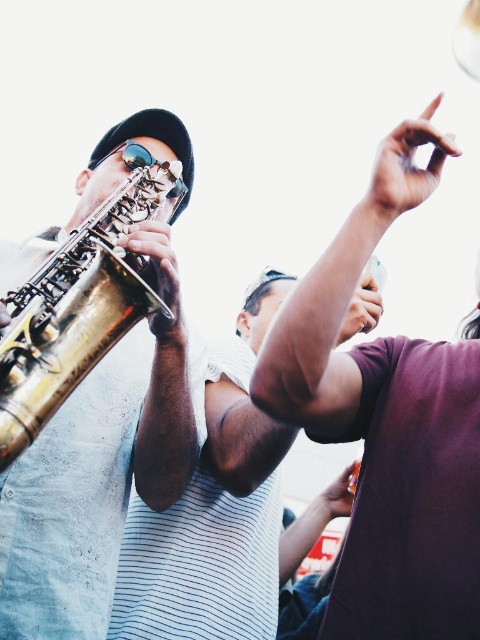
You are a photographer taking a picture of the scene. You notice the dark purple shirt at upper right and the gold polished trumpet at left. Which object should you focus on if you want to capture the larger one in your shot?

The dark purple shirt at upper right is bigger than the gold polished trumpet at left, so you should focus on the dark purple shirt at upper right to capture the larger one.

You are a photographer standing in the crowd and want to take a photo that includes both the dark purple shirt at upper right and the gold polished trumpet at left. Which object should you focus on first to ensure both are in the frame?

The dark purple shirt at upper right is much taller than the gold polished trumpet at left, so you should focus on the dark purple shirt at upper right first to ensure both are in the frame.

You are standing in the crowd watching the saxophonist. You notice two points in the scene. The first point is at coordinates point (370, 371) and the second is at point (122, 216). Which point is closer to you?

Point (370, 371) is in front of point (122, 216), so the first point is closer to you.